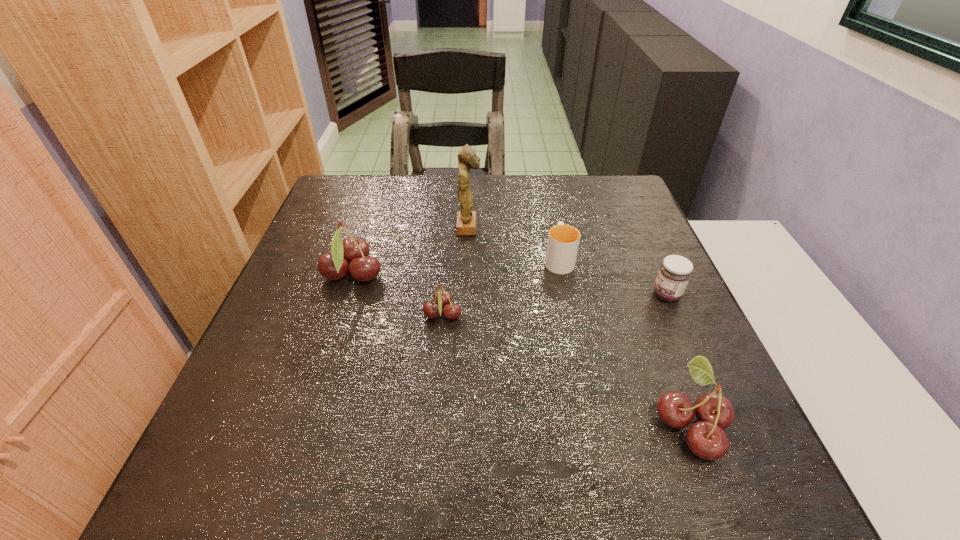
At what (x,y) coordinates should I click in order to perform the action: click on vacant space that's between the cup and the figurine. Please return your answer as a coordinate pair (x, y). The width and height of the screenshot is (960, 540). Looking at the image, I should click on tap(514, 243).

Locate an element on the screen. The width and height of the screenshot is (960, 540). object that is the third closest to the leftmost object is located at coordinates (563, 240).

Identify which object is the second closest to the leftmost cherry. Please provide its 2D coordinates. Your answer should be formatted as a tuple, i.e. [(x, y)], where the tuple contains the x and y coordinates of a point satisfying the conditions above.

[(467, 159)]

Identify the location of cherry that is the second closest to the farthest object. Image resolution: width=960 pixels, height=540 pixels. (442, 298).

The image size is (960, 540). In order to click on the second closest cherry to the cup in this screenshot , I will do `click(706, 438)`.

This screenshot has width=960, height=540. In order to click on vacant area in the image that satisfies the following two spatial constraints: 1. with the handle on the side of the third object from right to left; 2. on the front-facing side of the figurine in this screenshot , I will do `click(552, 227)`.

This screenshot has width=960, height=540. Find the location of `free location that satisfies the following two spatial constraints: 1. on the front-facing side of the tallest object; 2. with the handle on the side of the third object from right to left`. free location that satisfies the following two spatial constraints: 1. on the front-facing side of the tallest object; 2. with the handle on the side of the third object from right to left is located at coordinates (468, 259).

You are a GUI agent. You are given a task and a screenshot of the screen. Output one action in this format:
    pyautogui.click(x=<x>, y=<y>)
    Task: Click on the free point that satisfies the following two spatial constraints: 1. with the handle on the side of the third object from right to left; 2. on the front-facing side of the tallest object
    This screenshot has width=960, height=540.
    Given the screenshot: What is the action you would take?
    pyautogui.click(x=552, y=227)